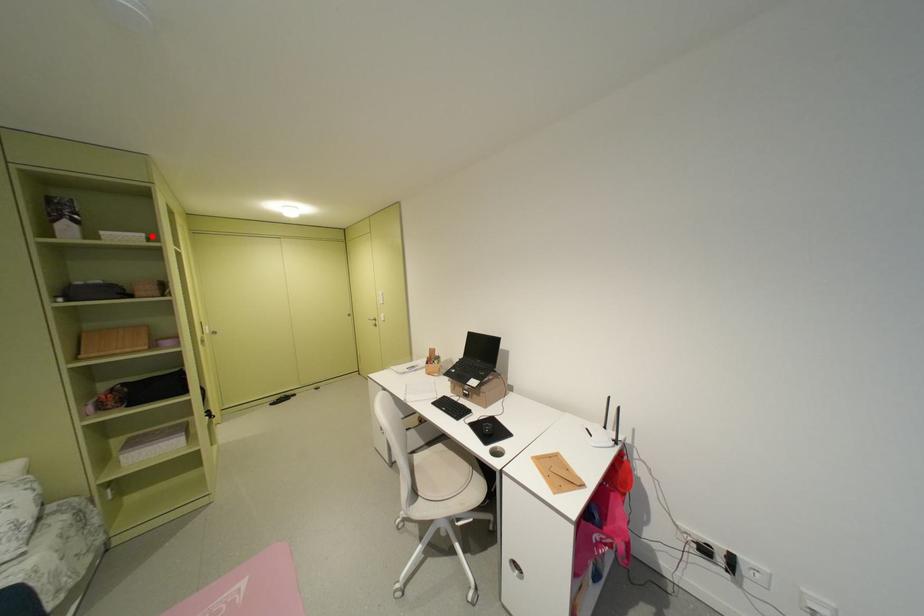
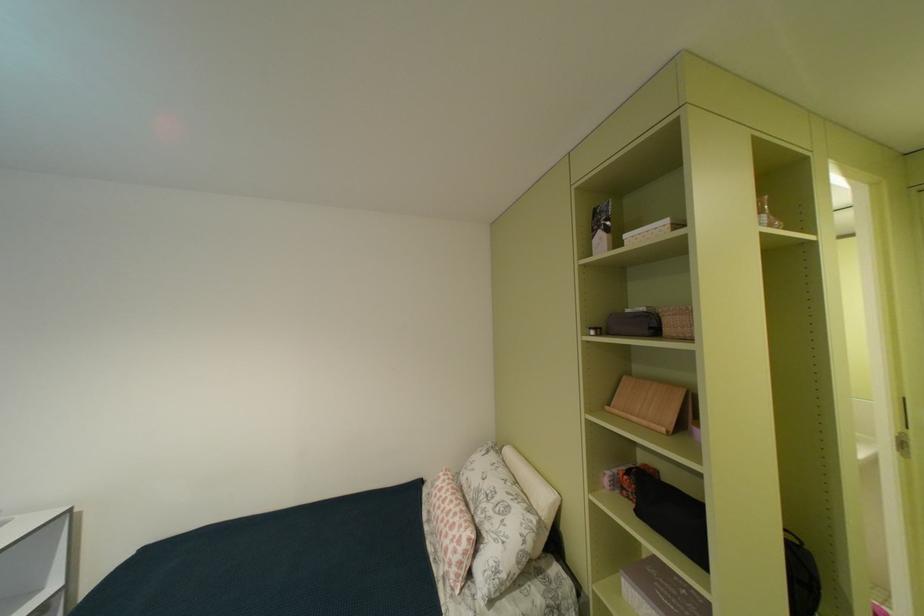
Find the pixel in the second image that matches the highlighted location in the first image.

(676, 223)